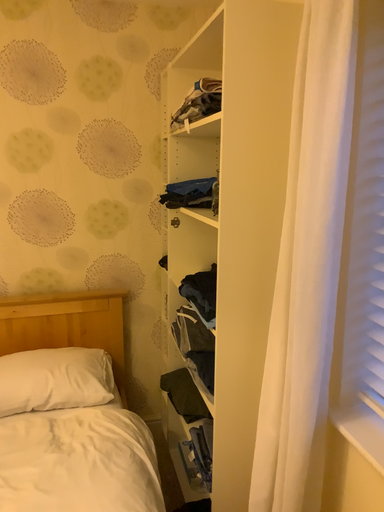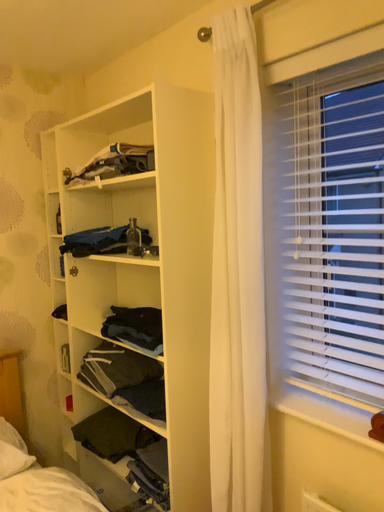
Question: Which way did the camera rotate in the video?

Choices:
 (A) rotated upward
 (B) rotated downward

Answer: (A)